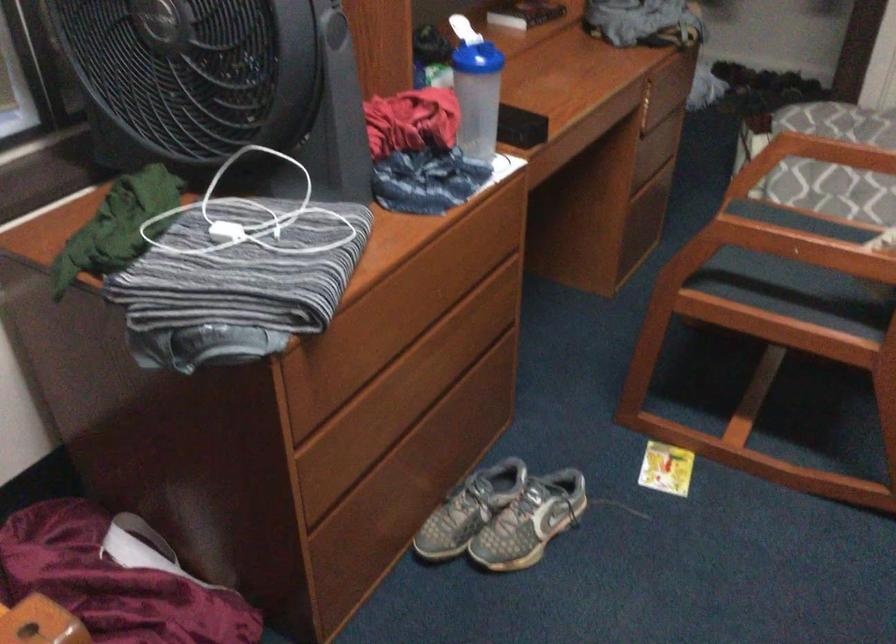
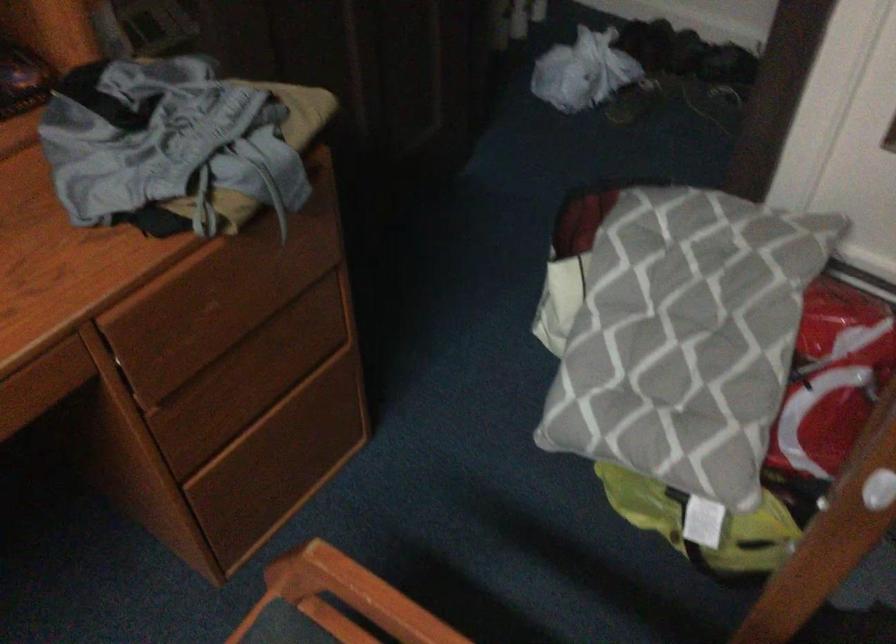
Which direction would the cameraman need to move to produce the second image?

The cameraman moved toward right, forward.